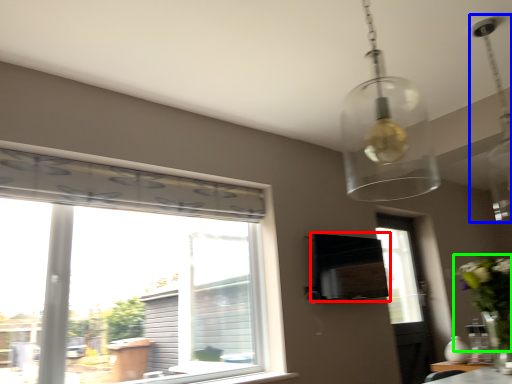
Question: Which is nearer to the vent (highlighted by a red box)? light fixture (highlighted by a blue box) or floral arrangement (highlighted by a green box).

Choices:
 (A) light fixture
 (B) floral arrangement

Answer: (B)